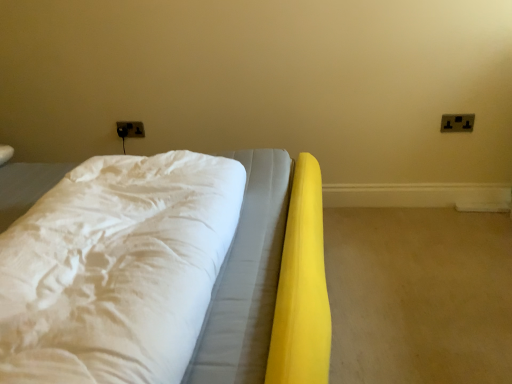
Question: Is white fabric bed at center wider or thinner than black plastic electric outlet at upper right, placed as the 2th electric outlet when sorted from left to right?

Choices:
 (A) wide
 (B) thin

Answer: (A)

Question: Visually, is white fabric bed at center positioned to the left or to the right of black plastic electric outlet at upper right, arranged as the 2th electric outlet when viewed from the back?

Choices:
 (A) right
 (B) left

Answer: (B)

Question: Estimate the real-world distances between objects in this image. Which object is closer to the black plastic electric outlet at upper right, arranged as the 2th electric outlet when viewed from the back?

Choices:
 (A) white fabric bed at center
 (B) black plastic electrical outlet at upper left, acting as the second electric outlet starting from the front

Answer: (A)

Question: Estimate the real-world distances between objects in this image. Which object is closer to the black plastic electrical outlet at upper left, arranged as the second electric outlet when viewed from the right?

Choices:
 (A) white fabric bed at center
 (B) black plastic electric outlet at upper right, placed as the first electric outlet when sorted from front to back

Answer: (A)